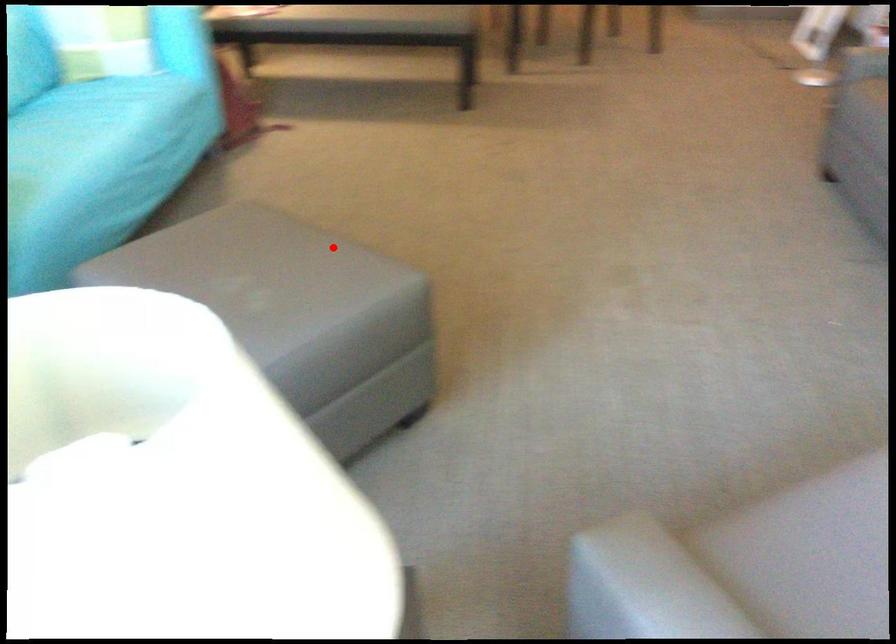
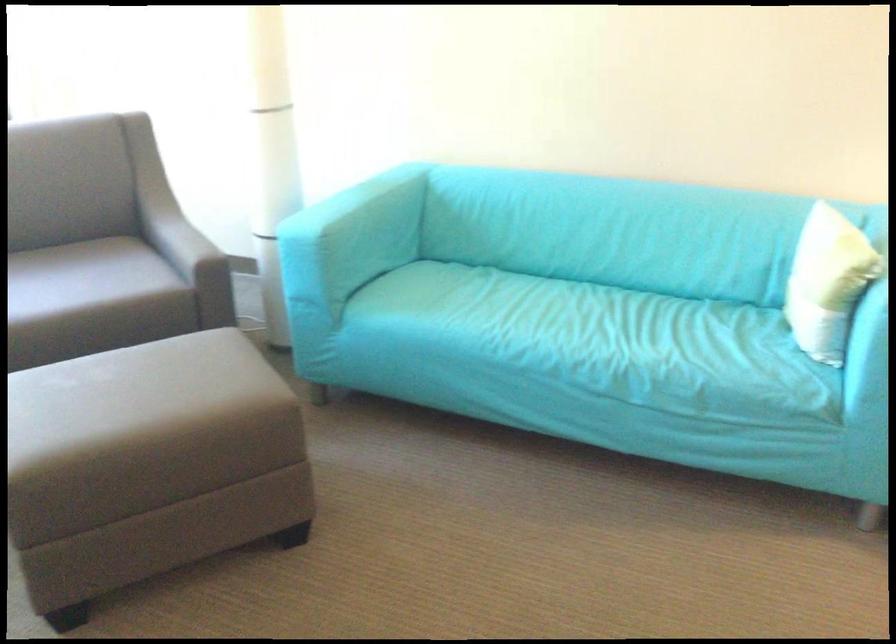
Locate, in the second image, the point that corresponds to the highlighted location in the first image.

(149, 464)